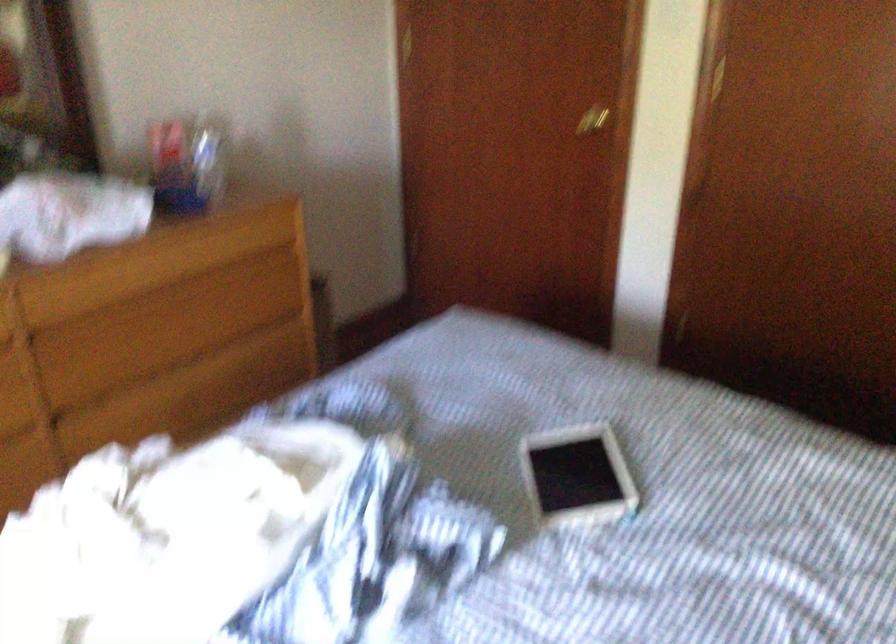
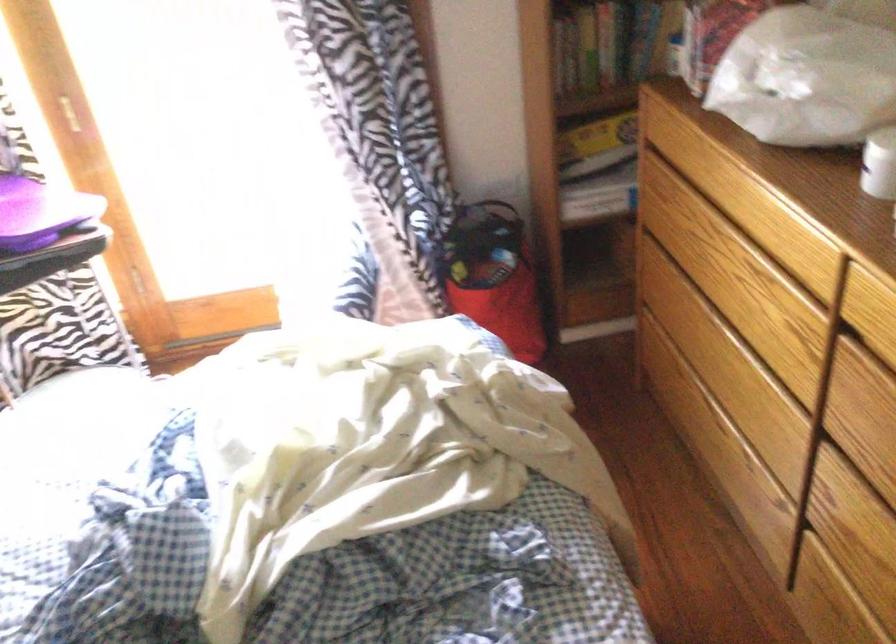
In the second image, find the point that corresponds to (92,383) in the first image.

(868, 460)